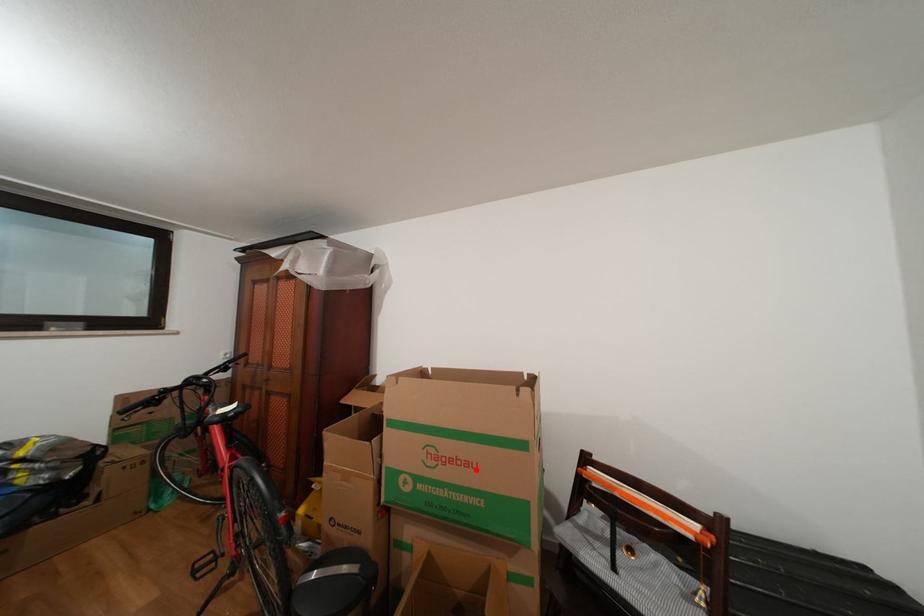
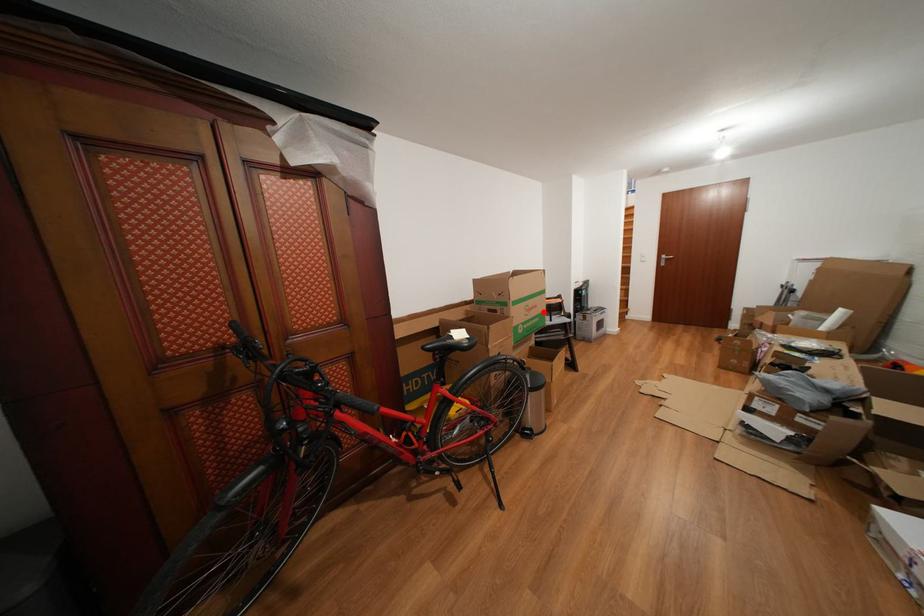
I am providing you with two images of the same scene from different viewpoints. A red point is marked on the first image and another point is marked on the second image. Does the point marked in image1 correspond to the same location as the one in image2?

Yes